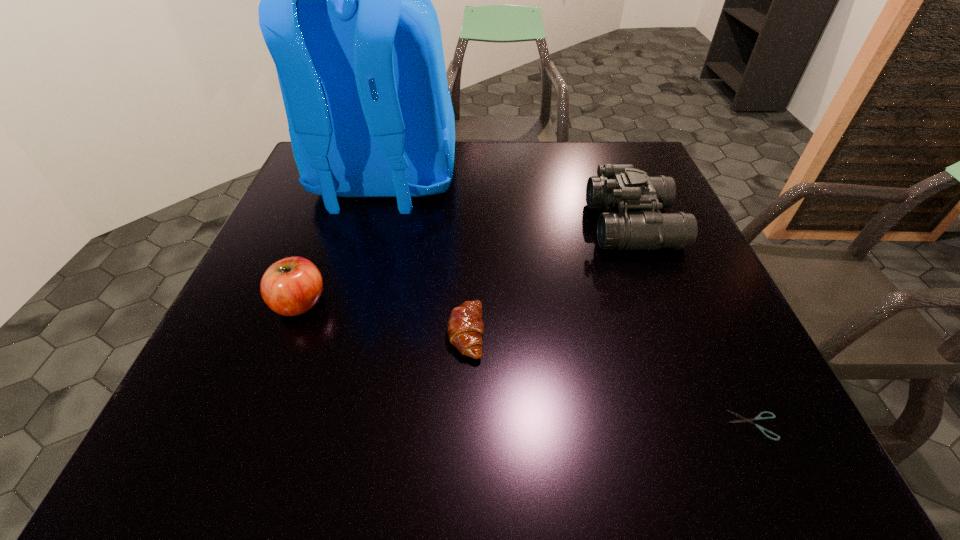
This screenshot has width=960, height=540. I want to click on free location that satisfies the following two spatial constraints: 1. on the back of the shortest object; 2. on the right side of the backpack, so click(318, 425).

This screenshot has width=960, height=540. What are the coordinates of `vacant space that satisfies the following two spatial constraints: 1. through the lenses of the fourth shortest object; 2. on the left side of the shears` in the screenshot? It's located at (711, 425).

Image resolution: width=960 pixels, height=540 pixels. What are the coordinates of `free space that satisfies the following two spatial constraints: 1. through the lenses of the binoculars; 2. on the front side of the third object from right to left` in the screenshot? It's located at (675, 333).

Locate an element on the screen. free space that satisfies the following two spatial constraints: 1. through the lenses of the second tallest object; 2. on the front side of the third shortest object is located at coordinates (663, 303).

Find the location of `vacant space that satisfies the following two spatial constraints: 1. on the back of the backpack; 2. on the left side of the third object from right to left`. vacant space that satisfies the following two spatial constraints: 1. on the back of the backpack; 2. on the left side of the third object from right to left is located at coordinates (343, 333).